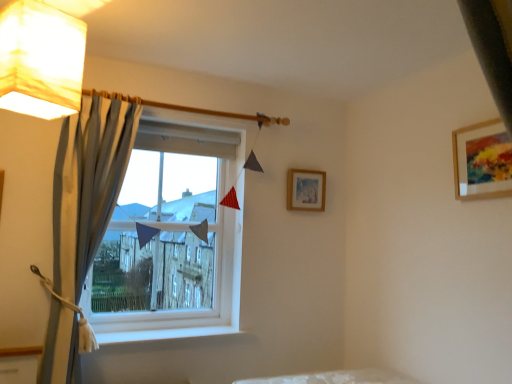
Question: Does white paper lampshade at upper left have a smaller size compared to white plastic window at center?

Choices:
 (A) yes
 (B) no

Answer: (A)

Question: Does white paper lampshade at upper left have a lesser height compared to white plastic window at center?

Choices:
 (A) no
 (B) yes

Answer: (B)

Question: Is white paper lampshade at upper left positioned before white plastic window at center?

Choices:
 (A) no
 (B) yes

Answer: (B)

Question: Considering the relative positions of white paper lampshade at upper left and white plastic window at center in the image provided, is white paper lampshade at upper left to the right of white plastic window at center from the viewer's perspective?

Choices:
 (A) no
 (B) yes

Answer: (A)

Question: From a real-world perspective, is white paper lampshade at upper left under white plastic window at center?

Choices:
 (A) yes
 (B) no

Answer: (B)

Question: Can you confirm if white paper lampshade at upper left is bigger than white plastic window at center?

Choices:
 (A) yes
 (B) no

Answer: (B)

Question: From a real-world perspective, is white paper lampshade at upper left physically below wooden-framed artwork at upper right, positioned as the first picture frame in front-to-back order?

Choices:
 (A) yes
 (B) no

Answer: (B)

Question: From the image's perspective, is white paper lampshade at upper left on top of wooden-framed artwork at upper right, positioned as the second picture frame in left-to-right order?

Choices:
 (A) yes
 (B) no

Answer: (A)

Question: Is wooden-framed artwork at upper right, positioned as the first picture frame in front-to-back order, surrounded by white paper lampshade at upper left?

Choices:
 (A) yes
 (B) no

Answer: (B)

Question: Considering the relative positions of white paper lampshade at upper left and wooden-framed artwork at upper right, positioned as the first picture frame in front-to-back order, in the image provided, is white paper lampshade at upper left to the left of wooden-framed artwork at upper right, positioned as the first picture frame in front-to-back order, from the viewer's perspective?

Choices:
 (A) yes
 (B) no

Answer: (A)

Question: Is white paper lampshade at upper left closer to the viewer compared to wooden-framed artwork at upper right, the first picture frame when ordered from right to left?

Choices:
 (A) yes
 (B) no

Answer: (A)

Question: Is white paper lampshade at upper left wider than wooden-framed artwork at upper right, positioned as the first picture frame in front-to-back order?

Choices:
 (A) yes
 (B) no

Answer: (A)

Question: Is white smooth window sill at lower center located within white plastic window at center?

Choices:
 (A) yes
 (B) no

Answer: (B)